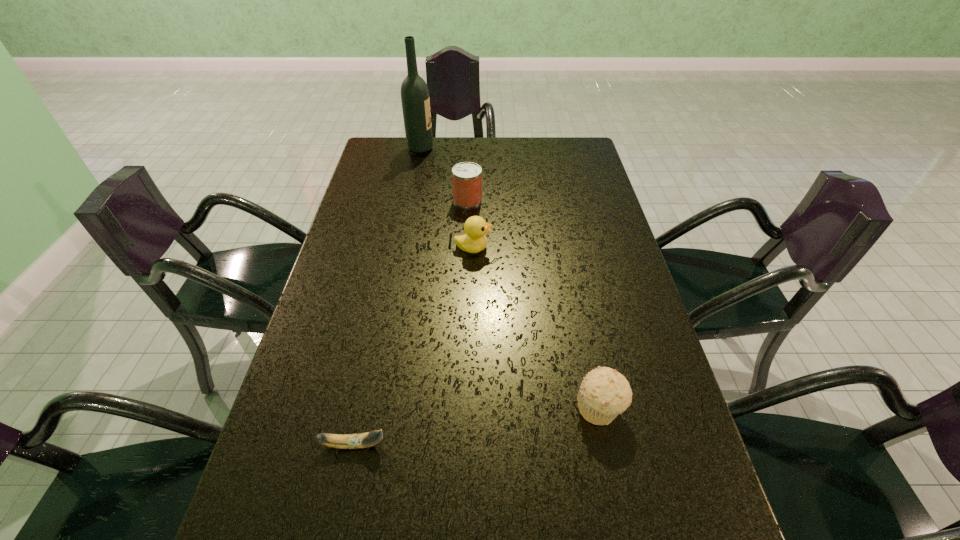
Identify the location of free point at the right edge. The height and width of the screenshot is (540, 960). (644, 386).

You are a GUI agent. You are given a task and a screenshot of the screen. Output one action in this format:
    pyautogui.click(x=<x>, y=<y>)
    Task: Click on the free space at the far right corner
    
    Given the screenshot: What is the action you would take?
    pyautogui.click(x=573, y=153)

At what (x,y) coordinates should I click in order to perform the action: click on free point between the third farthest object and the muffin. Please return your answer as a coordinate pair (x, y). Looking at the image, I should click on (537, 328).

This screenshot has width=960, height=540. Find the location of `vacant area that lies between the wine bottle and the banana`. vacant area that lies between the wine bottle and the banana is located at coordinates (387, 296).

Find the location of a particular element. This screenshot has width=960, height=540. vacant space that's between the banana and the second farthest object is located at coordinates (411, 322).

This screenshot has height=540, width=960. Find the location of `empty location between the shortest object and the muffin`. empty location between the shortest object and the muffin is located at coordinates (477, 426).

Where is `empty location between the rightmost object and the shortest object`? This screenshot has height=540, width=960. empty location between the rightmost object and the shortest object is located at coordinates (477, 426).

At what (x,y) coordinates should I click in order to perform the action: click on vacant point located between the can and the nearest object. Please return your answer as a coordinate pair (x, y). Looking at the image, I should click on (411, 322).

In order to click on free space between the nearest object and the can in this screenshot , I will do `click(411, 322)`.

What are the coordinates of `free area in between the rightmost object and the third nearest object` in the screenshot? It's located at (537, 328).